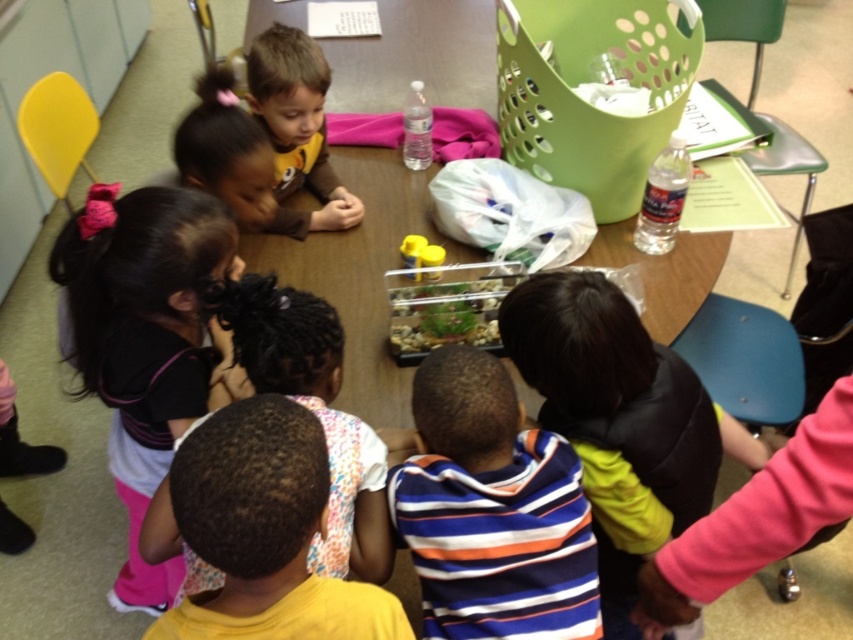
Who is lower down, wooden table at center or pink fabric at lower left?

pink fabric at lower left is below.

Which is in front, point (252, 240) or point (128, 465)?

Point (128, 465) is in front.

Identify the location of wooden table at center. This screenshot has height=640, width=853. (363, 272).

Which is above, striped cotton shirt at center or pink fabric at lower left?

pink fabric at lower left is above.

This screenshot has width=853, height=640. What are the coordinates of `striped cotton shirt at center` in the screenshot? It's located at (491, 509).

Is pink fabric at lower left bigger than transparent plastic aquarium at center?

Correct, pink fabric at lower left is larger in size than transparent plastic aquarium at center.

Is point (103, 218) farther from viewer compared to point (479, 333)?

No, it is in front of (479, 333).

This screenshot has height=640, width=853. What do you see at coordinates (142, 340) in the screenshot?
I see `pink fabric at lower left` at bounding box center [142, 340].

The image size is (853, 640). Find the location of `pink fabric at lower left`. pink fabric at lower left is located at coordinates (142, 340).